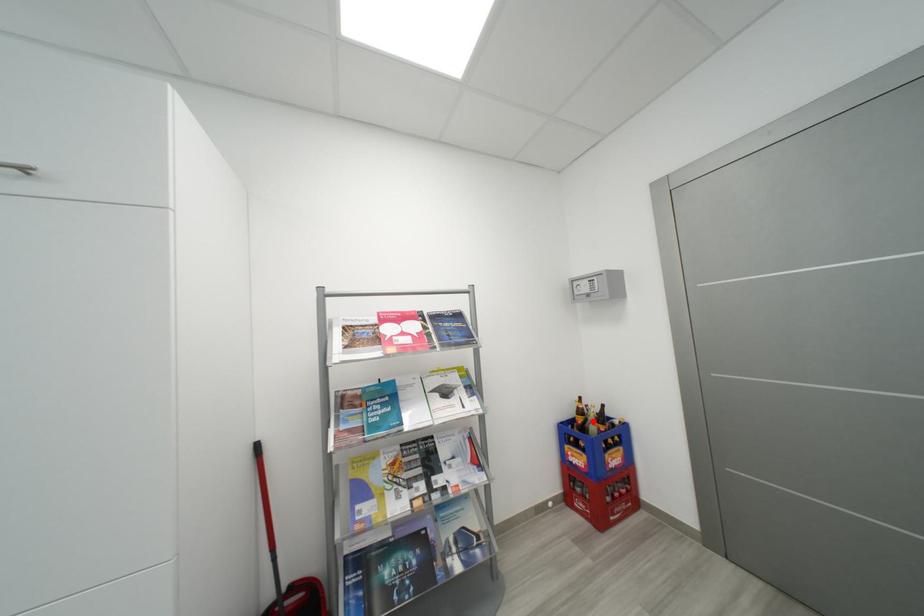
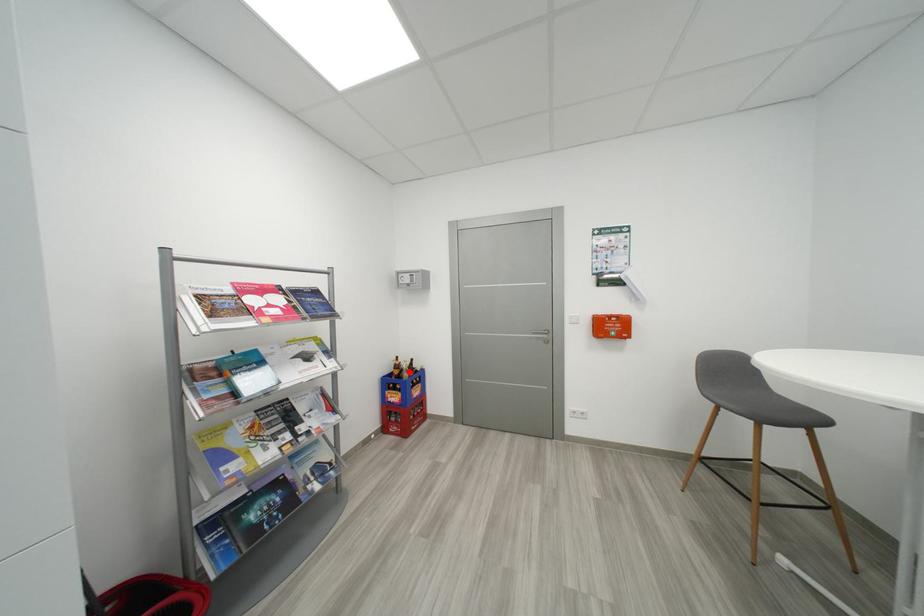
I am providing you with two images of the same scene from different viewpoints. A red point is marked on the first image and another point is marked on the second image. Are the points marked in image1 and image2 representing the same 3D position?

Yes